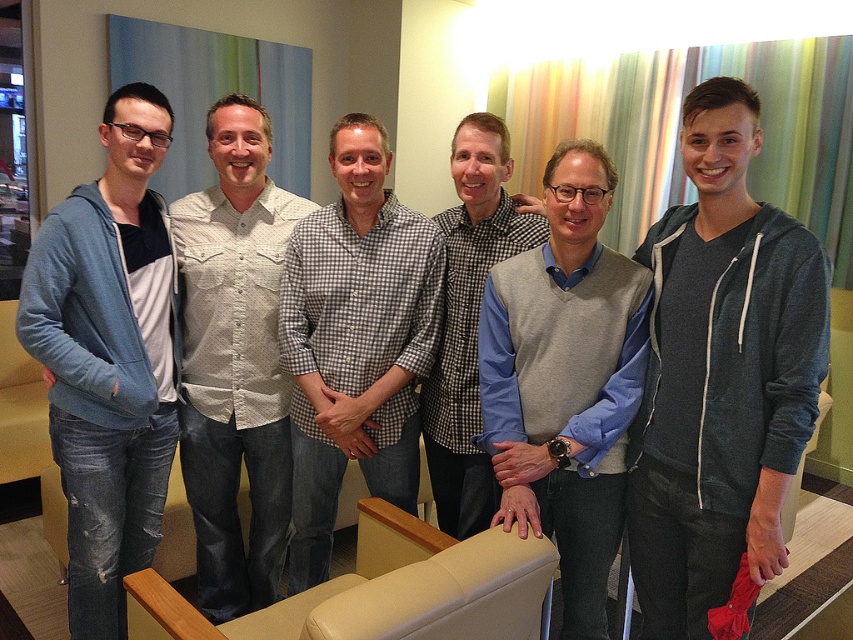
You are standing in the room and want to find the light gray sweater vest at center. Based on its coordinates, where should you look?

You should look at point (566, 380) to find the light gray sweater vest at center.

You are organizing a group photo and need to arrange the light beige textured shirt at center and the checkered shirt at center in a specific order. According to the image, which one should be placed to the left of the other?

The light beige textured shirt at center should be placed to the left of the checkered shirt at center because it is positioned on the left side of the checkered shirt at center in the image.

Based on the scene description, where is the checkered fabric shirt at center located in terms of its 2D coordinates?

The checkered fabric shirt at center is located at the 2D coordinates of point (355, 340).